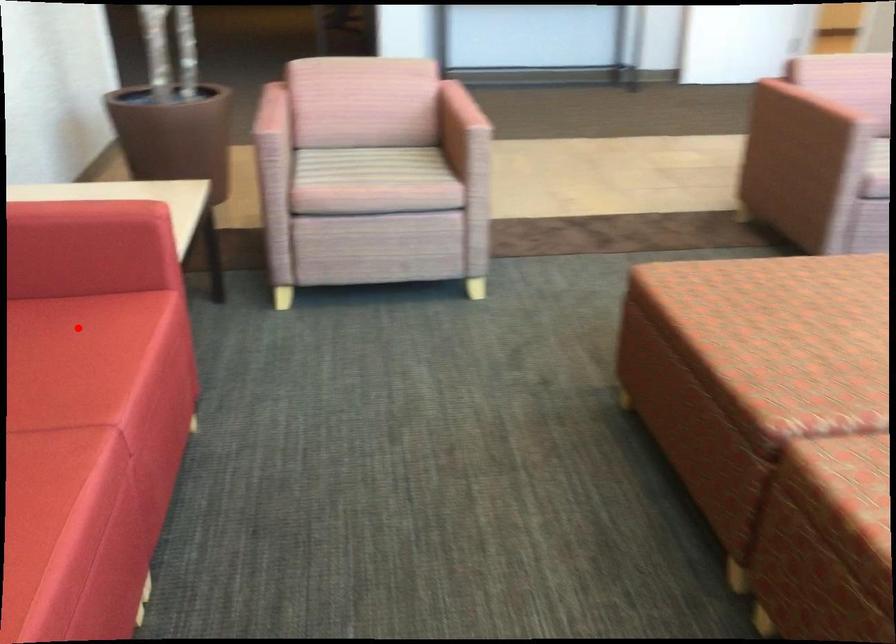
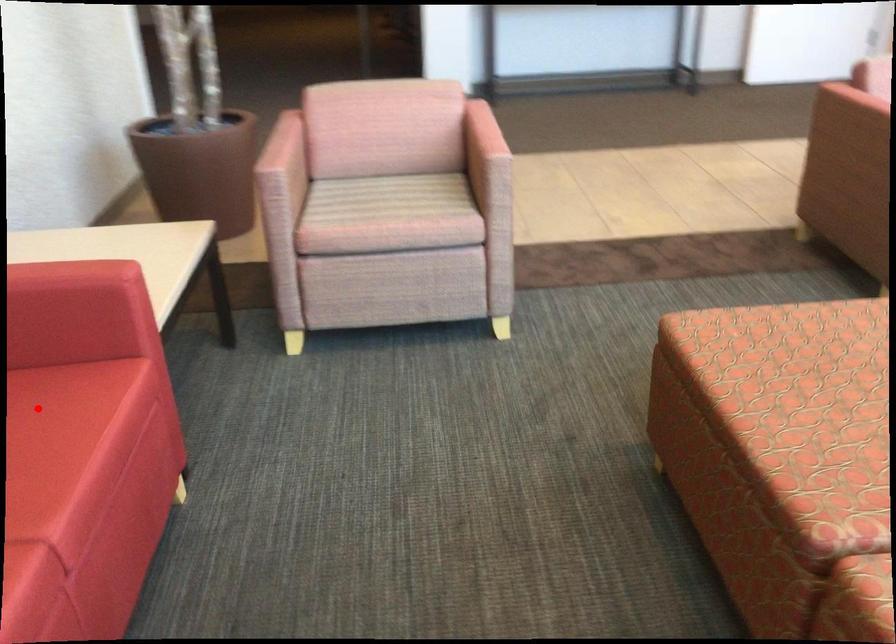
I am providing you with two images of the same scene from different viewpoints. A red point is marked on the first image and another point is marked on the second image. Are the points marked in image1 and image2 representing the same 3D position?

Yes